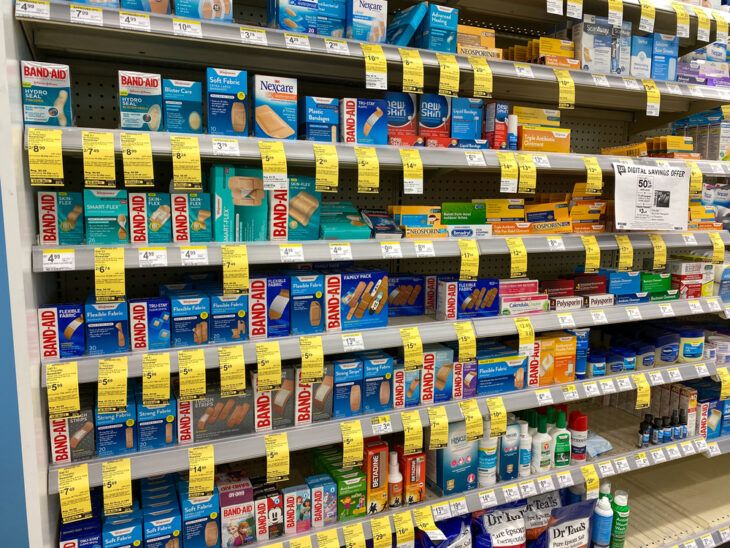
Identify the location of black and white paper hanging on shelf. The height and width of the screenshot is (548, 730). click(650, 180).